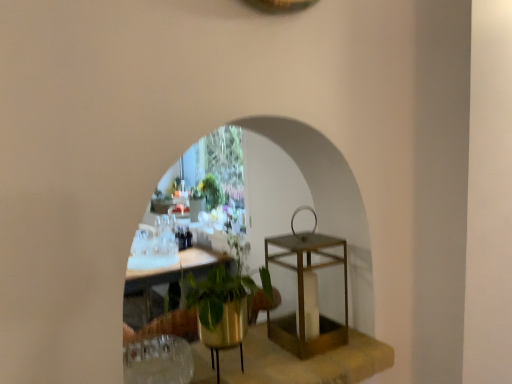
Where is `free location to the right of gold metallic table at center`? free location to the right of gold metallic table at center is located at coordinates (356, 342).